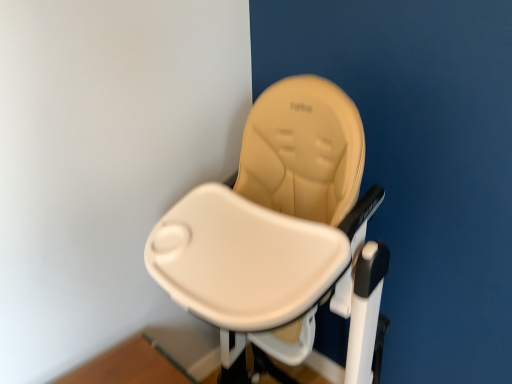
Describe the element at coordinates (281, 235) in the screenshot. The height and width of the screenshot is (384, 512). I see `beige plastic highchair at center` at that location.

Identify the location of beige plastic highchair at center. (281, 235).

Locate an element on the screen. beige plastic highchair at center is located at coordinates (281, 235).